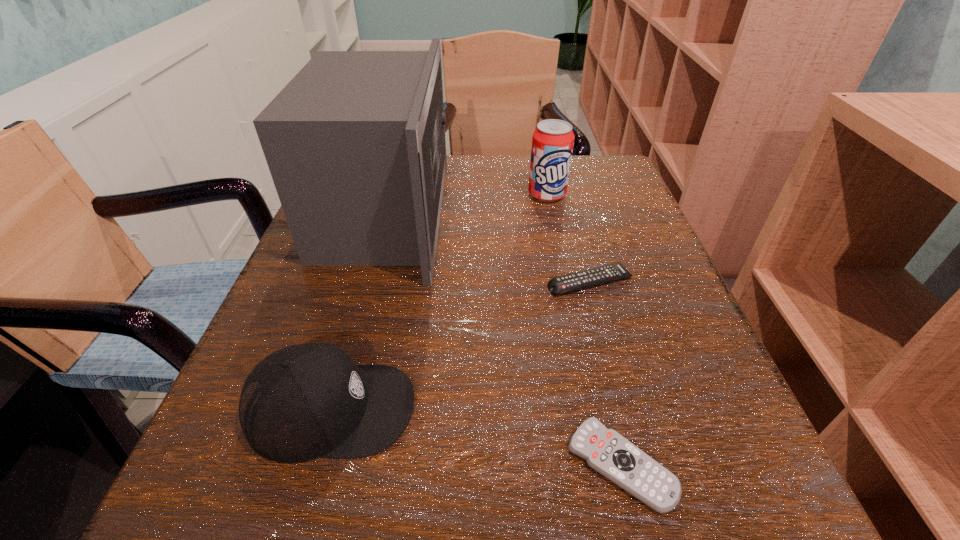
Identify the location of unoccupied area between the third tallest object and the fourth shortest object. (440, 302).

The image size is (960, 540). I want to click on vacant area that lies between the soda can and the microwave oven, so click(x=467, y=204).

Identify the location of vacant area that lies between the fourth shortest object and the shorter remote control. This screenshot has height=540, width=960. (584, 329).

Identify the location of vacant space that is in between the third tallest object and the fourth shortest object. The height and width of the screenshot is (540, 960). (440, 302).

Locate an element on the screen. The image size is (960, 540). free space between the farther remote control and the soda can is located at coordinates (568, 239).

You are a GUI agent. You are given a task and a screenshot of the screen. Output one action in this format:
    pyautogui.click(x=<x>, y=<y>)
    Task: Click on the empty space that is in between the third tallest object and the microwave oven
    The image size is (960, 540).
    Given the screenshot: What is the action you would take?
    pyautogui.click(x=358, y=311)

Find the location of a particular element. Image resolution: width=960 pixels, height=540 pixels. free space between the cap and the farther remote control is located at coordinates (461, 346).

Locate which object is the second closest to the third shortest object. Please provide its 2D coordinates. Your answer should be formatted as a tuple, i.e. [(x, y)], where the tuple contains the x and y coordinates of a point satisfying the conditions above.

[(606, 451)]

At what (x,y) coordinates should I click in order to perform the action: click on object that is the second closest to the third tallest object. Please return your answer as a coordinate pair (x, y). This screenshot has height=540, width=960. Looking at the image, I should click on (606, 451).

The image size is (960, 540). I want to click on vacant space that satisfies the following two spatial constraints: 1. on the front-facing side of the farther remote control; 2. on the right side of the tallest object, so click(366, 282).